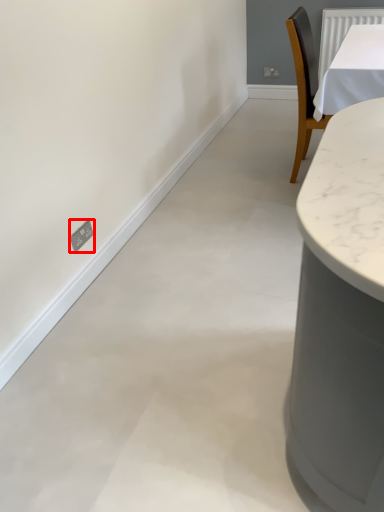
Question: From the image's perspective, where is electric outlet (annotated by the red box) located relative to backdrop?

Choices:
 (A) above
 (B) below

Answer: (B)